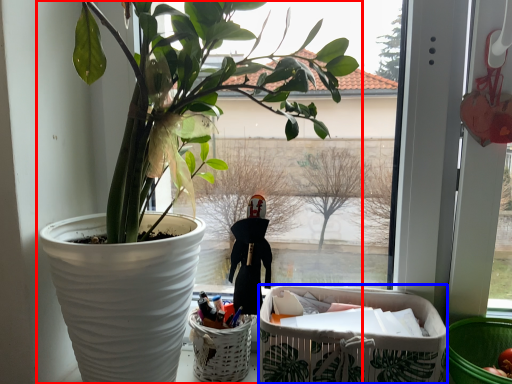
Question: Which object appears closest to the camera in this image, houseplant (highlighted by a red box) or shopping basket (highlighted by a blue box)?

Choices:
 (A) houseplant
 (B) shopping basket

Answer: (A)